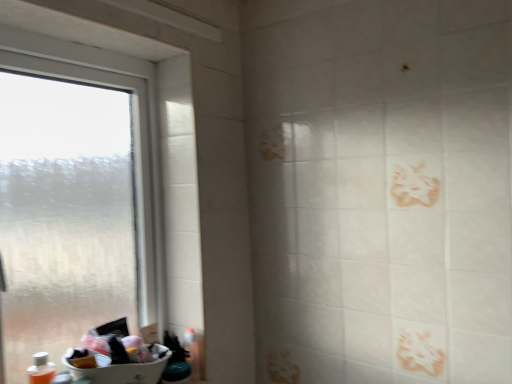
Question: Considering the relative positions of transparent frosted glass window at left and white plastic sink at lower left in the image provided, is transparent frosted glass window at left to the left or to the right of white plastic sink at lower left?

Choices:
 (A) left
 (B) right

Answer: (A)

Question: From a real-world perspective, is transparent frosted glass window at left positioned above or below white plastic sink at lower left?

Choices:
 (A) above
 (B) below

Answer: (A)

Question: Estimate the real-world distances between objects in this image. Which object is closer to the white plastic sink at lower left?

Choices:
 (A) transparent frosted glass window at left
 (B) translucent plastic bottle at lower left

Answer: (B)

Question: Which of these objects is positioned farthest from the translucent plastic bottle at lower left?

Choices:
 (A) white plastic sink at lower left
 (B) transparent frosted glass window at left

Answer: (B)